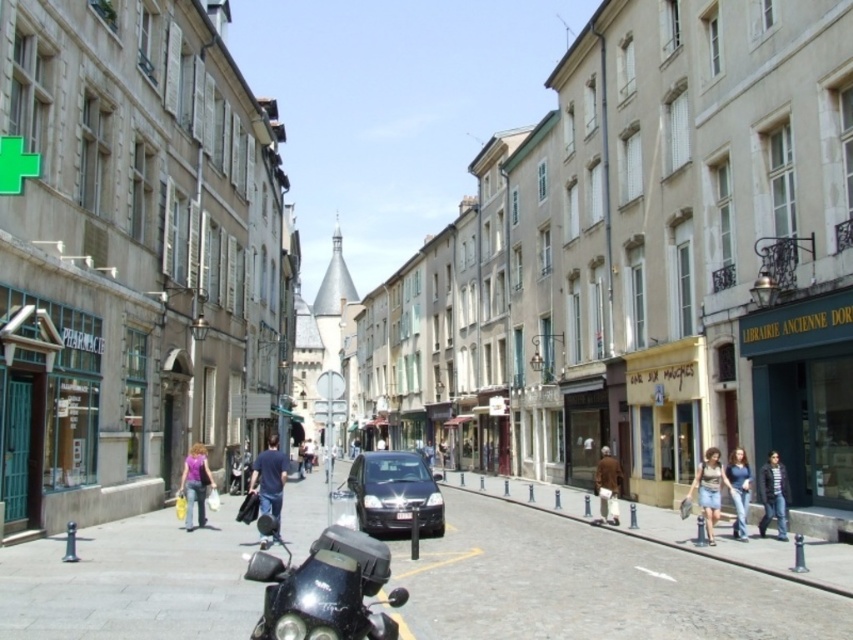
You are a delivery person who needs to park your shiny black motorcycle at lower left near the pharmacy on the left side of the street. However, there is a dark blue shirt at center in the way. Given that the motorcycle is narrower than the shirt, can you still maneuver around it to park?

The shiny black motorcycle at lower left has a lesser width compared to the dark blue shirt at center, so yes, you can maneuver around the dark blue shirt at center to park the motorcycle since it is narrower.

You are a tourist standing on the smooth cobblestone street at center and want to take a photo of the blue jeans at lower right. Which object should you focus your camera on first, considering their positions?

The smooth cobblestone street at center is much taller than the blue jeans at lower right, so you should focus your camera on the smooth cobblestone street at center first as it is closer to the camera.